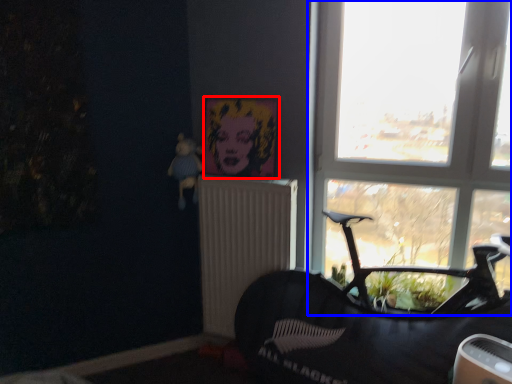
Question: Which of the following is the farthest to the observer, picture frame (highlighted by a red box) or window (highlighted by a blue box)?

Choices:
 (A) picture frame
 (B) window

Answer: (A)